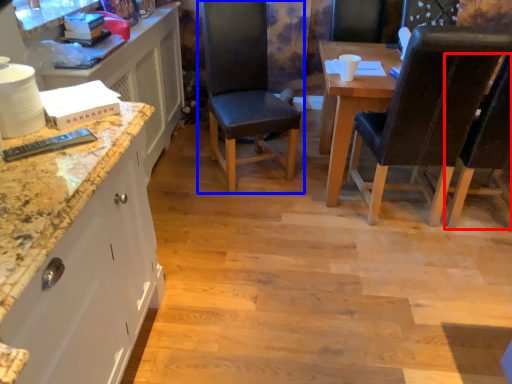
Question: Which point is closer to the camera, chair (highlighted by a red box) or chair (highlighted by a blue box)?

Choices:
 (A) chair
 (B) chair

Answer: (A)